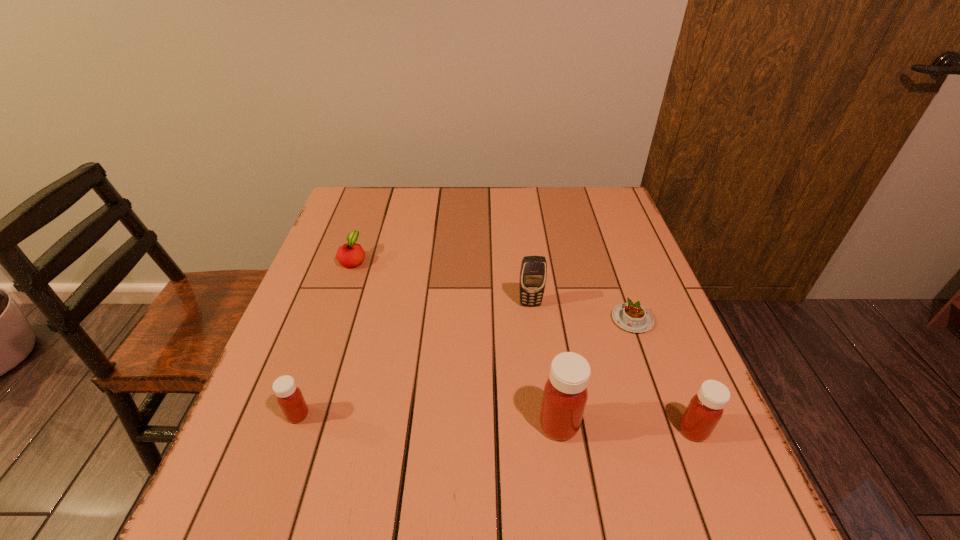
Where is `vacant space in between the shortest object and the apple`? vacant space in between the shortest object and the apple is located at coordinates (x=492, y=289).

Identify the location of free area in between the tallest medicine and the cellular telephone. The width and height of the screenshot is (960, 540). (544, 364).

At what (x,y) coordinates should I click in order to perform the action: click on vacant space in between the cellular telephone and the pudding. Please return your answer as a coordinate pair (x, y). Looking at the image, I should click on (581, 312).

Locate an element on the screen. This screenshot has width=960, height=540. vacant space that's between the third shortest object and the second medicine from right to left is located at coordinates (428, 420).

Locate an element on the screen. This screenshot has height=540, width=960. free space between the apple and the cellular telephone is located at coordinates [442, 282].

Find the location of a particular element. Image resolution: width=960 pixels, height=540 pixels. blank region between the fifth tallest object and the cellular telephone is located at coordinates click(x=442, y=282).

Where is `free space between the fourth tallest object and the rightmost medicine`? free space between the fourth tallest object and the rightmost medicine is located at coordinates (495, 422).

Find the location of a particular element. This screenshot has height=540, width=960. vacant area that lies between the fifth tallest object and the fourth tallest object is located at coordinates (325, 337).

Select which object is the closest to the shortest object. Please provide its 2D coordinates. Your answer should be formatted as a tuple, i.e. [(x, y)], where the tuple contains the x and y coordinates of a point satisfying the conditions above.

[(533, 273)]

Identify the location of object that stands as the fifth closest to the shortest object. The height and width of the screenshot is (540, 960). (289, 397).